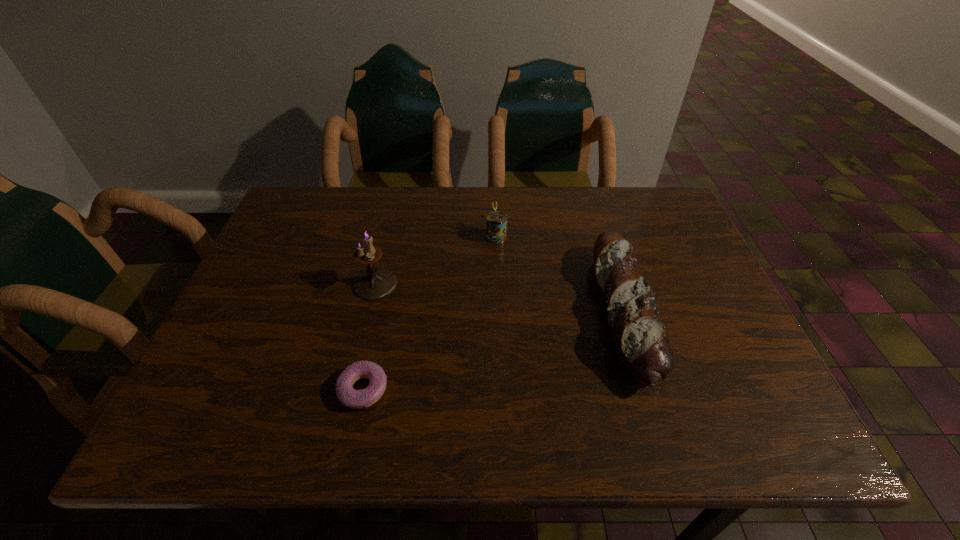
Locate an element on the screen. Image resolution: width=960 pixels, height=540 pixels. object situated at the near edge is located at coordinates (355, 399).

Where is `free space at the far edge of the desktop`? This screenshot has height=540, width=960. free space at the far edge of the desktop is located at coordinates (352, 234).

Image resolution: width=960 pixels, height=540 pixels. I want to click on vacant space at the near edge of the desktop, so click(679, 437).

Where is `free point at the left edge`? free point at the left edge is located at coordinates (233, 369).

In the image, there is a desktop. Where is `vacant space at the right edge`? The width and height of the screenshot is (960, 540). vacant space at the right edge is located at coordinates (710, 381).

I want to click on vacant space at the far left corner, so click(301, 187).

At what (x,y) coordinates should I click in order to perform the action: click on free space at the near left corner of the desktop. Please return your answer as a coordinate pair (x, y). This screenshot has width=960, height=540. Looking at the image, I should click on [212, 437].

What are the coordinates of `blank region between the second object from right to left and the baguet` in the screenshot? It's located at (560, 274).

Identify the location of vacant region between the rightmost object and the candle holder. (499, 298).

What are the coordinates of `vacant space that's between the can and the baguet` in the screenshot? It's located at (560, 274).